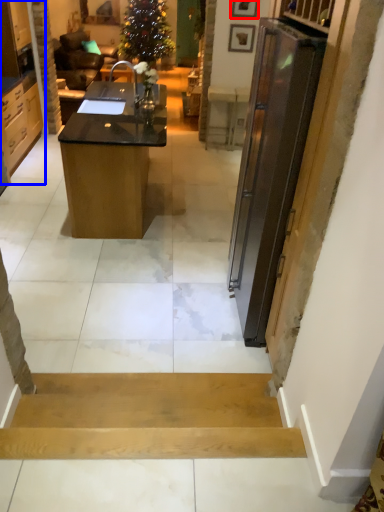
Question: Which point is further to the camera, picture frame (highlighted by a red box) or cabinetry (highlighted by a blue box)?

Choices:
 (A) picture frame
 (B) cabinetry

Answer: (A)